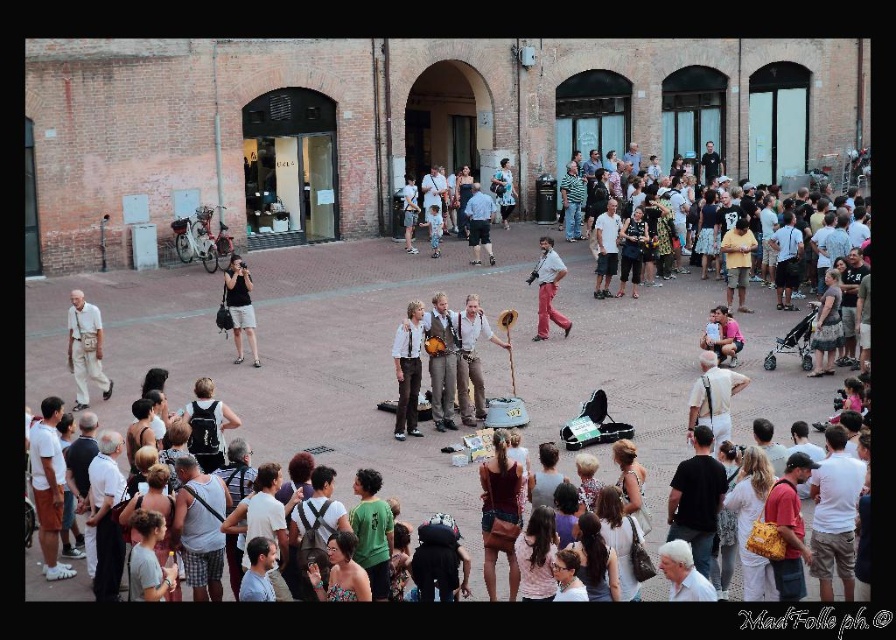
Question: Is light beige pants at left positioned behind light blue denim shorts at center?

Choices:
 (A) no
 (B) yes

Answer: (A)

Question: Which point appears closest to the camera in this image?

Choices:
 (A) (85, 371)
 (B) (464, 419)

Answer: (B)

Question: Which of these objects is positioned closest to the light beige pants at left?

Choices:
 (A) matte pink pants at center
 (B) matte brown vest at center
 (C) light blue denim shorts at center

Answer: (B)

Question: Which point appears farthest from the camera in this image?

Choices:
 (A) (554, 264)
 (B) (237, 288)
 (C) (395, 337)

Answer: (A)

Question: Considering the relative positions of light beige pants at left and light brown leather jacket at center in the image provided, where is light beige pants at left located with respect to light brown leather jacket at center?

Choices:
 (A) left
 (B) right

Answer: (A)

Question: Does matte brown vest at center appear on the left side of light blue denim shorts at center?

Choices:
 (A) yes
 (B) no

Answer: (A)